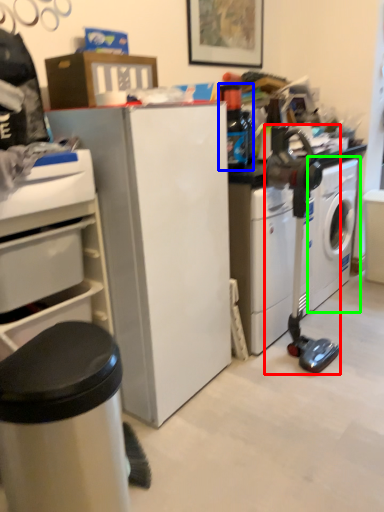
Question: Considering the real-world distances, which object is farthest from sewing machine (highlighted by a red box)? bottle (highlighted by a blue box) or washing machine (highlighted by a green box)?

Choices:
 (A) bottle
 (B) washing machine

Answer: (A)